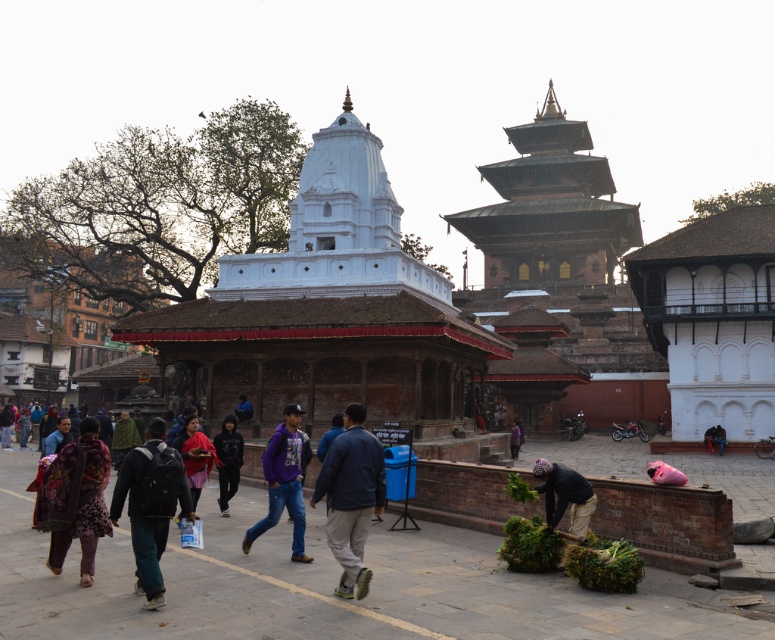
You are a visitor in the historical square and you see both the purple fleece jacket at center and the purple fabric at center. Which one is positioned to the right side?

The purple fabric at center is positioned to the right side of the purple fleece jacket at center.

You are standing in the historical square and see a point marked at coordinates (283,483). Which object is this point located on?

The point at coordinates (283,483) is located on the purple fleece jacket at center.